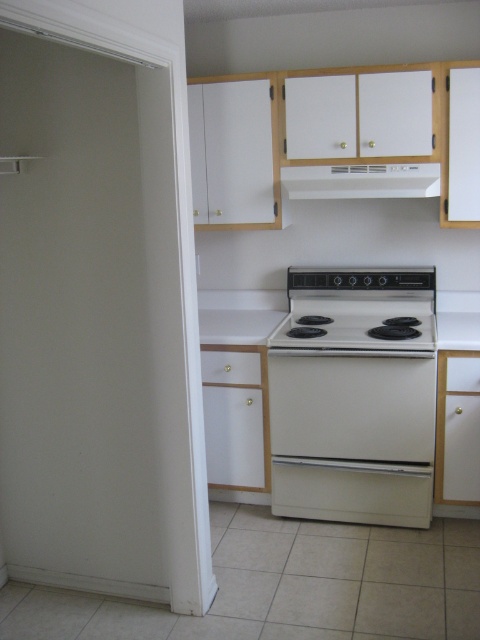
Does white matte exhaust hood at upper center have a smaller size compared to white glossy stove at center?

Correct, white matte exhaust hood at upper center occupies less space than white glossy stove at center.

Between point (372, 188) and point (290, 316), which one is positioned in front?

Point (372, 188)

The width and height of the screenshot is (480, 640). I want to click on white matte exhaust hood at upper center, so (360, 180).

Where is `white matte exhaust hood at upper center`? Image resolution: width=480 pixels, height=640 pixels. white matte exhaust hood at upper center is located at coordinates (360, 180).

Between point (380, 449) and point (349, 170), which one is positioned in front?

Positioned in front is point (380, 449).

Find the location of `white glossy electric stove at center`. white glossy electric stove at center is located at coordinates (355, 396).

Can you confirm if white glossy electric stove at center is wider than white glossy stove at center?

Yes.

Which of these two, white glossy electric stove at center or white glossy stove at center, stands shorter?

Standing shorter between the two is white glossy stove at center.

What do you see at coordinates (355, 396) in the screenshot? I see `white glossy electric stove at center` at bounding box center [355, 396].

Identify the location of white glossy electric stove at center. The width and height of the screenshot is (480, 640). (355, 396).